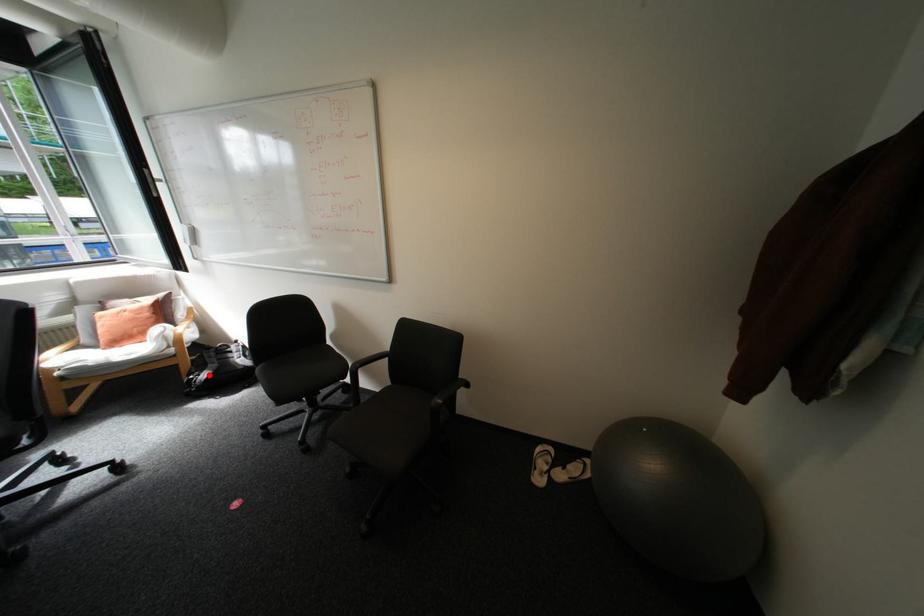
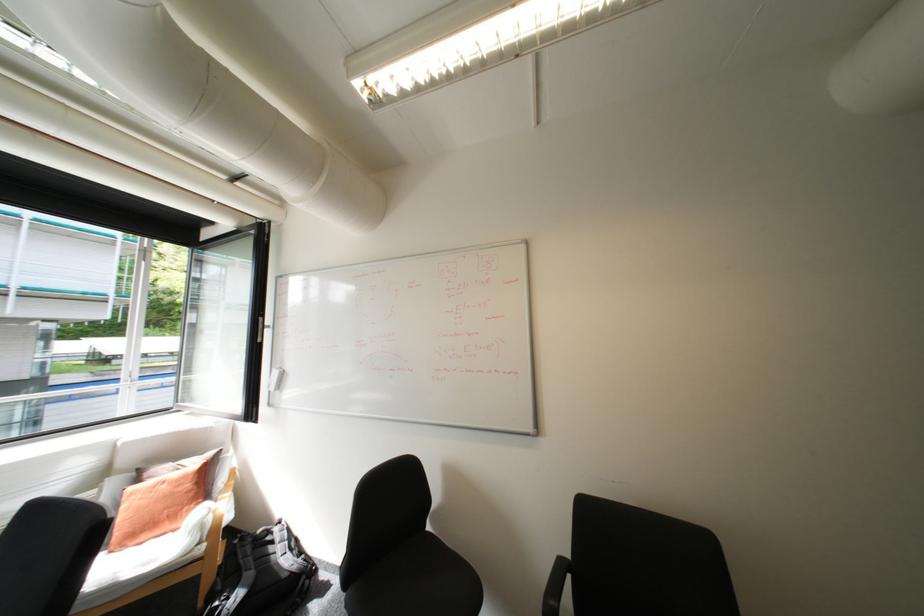
Locate, in the second image, the point that corresponds to the highlighted location in the first image.

(238, 599)